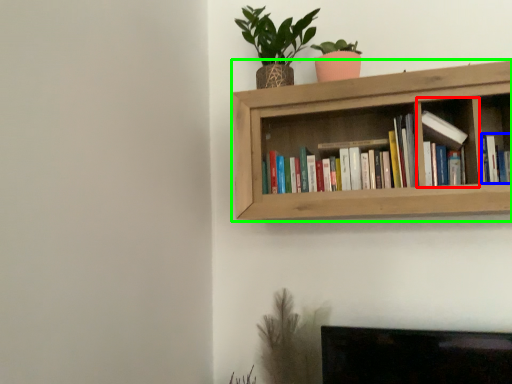
Question: Which object is the closest to the cabinet (highlighted by a red box)? Choose among these: book (highlighted by a blue box) or shelf (highlighted by a green box).

Choices:
 (A) book
 (B) shelf

Answer: (A)